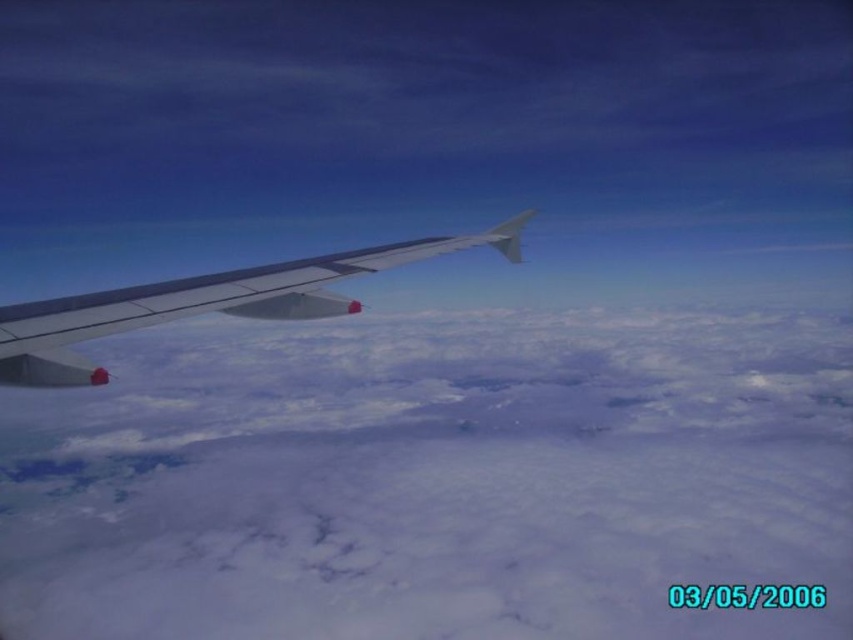
Question: Which point is closer to the camera?

Choices:
 (A) (149, 552)
 (B) (312, 272)

Answer: (B)

Question: Which of the following is the closest to the observer?

Choices:
 (A) metallic gray wing at left
 (B) white fluffy cloud at left

Answer: (A)

Question: Does white fluffy cloud at left have a larger size compared to metallic gray wing at left?

Choices:
 (A) yes
 (B) no

Answer: (A)

Question: Observing the image, what is the correct spatial positioning of white fluffy cloud at left in reference to metallic gray wing at left?

Choices:
 (A) right
 (B) left

Answer: (A)

Question: Does white fluffy cloud at left have a greater width compared to metallic gray wing at left?

Choices:
 (A) no
 (B) yes

Answer: (B)